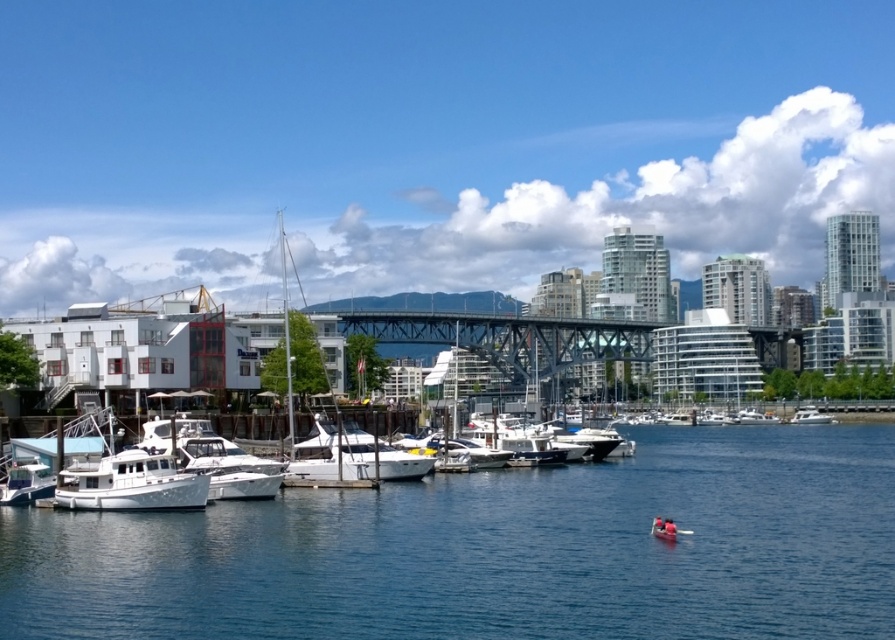
You are standing at the waterfront and want to locate two specific points in the scene. The first point is at coordinates point (305, 584) and the second is at point (322, 467). Which of these two points is nearer to your current position?

Point (305, 584) is closer to the viewer than point (322, 467), so the first point is nearer to your current position.

You are standing at the camera position and want to take a photo of the white glossy boat at center. Considering the boat is 64.63 meters away, do you need to use a zoom lens to capture it clearly?

The white glossy boat at center is 64.63 meters away, so you should use a zoom lens to capture it clearly from that distance.